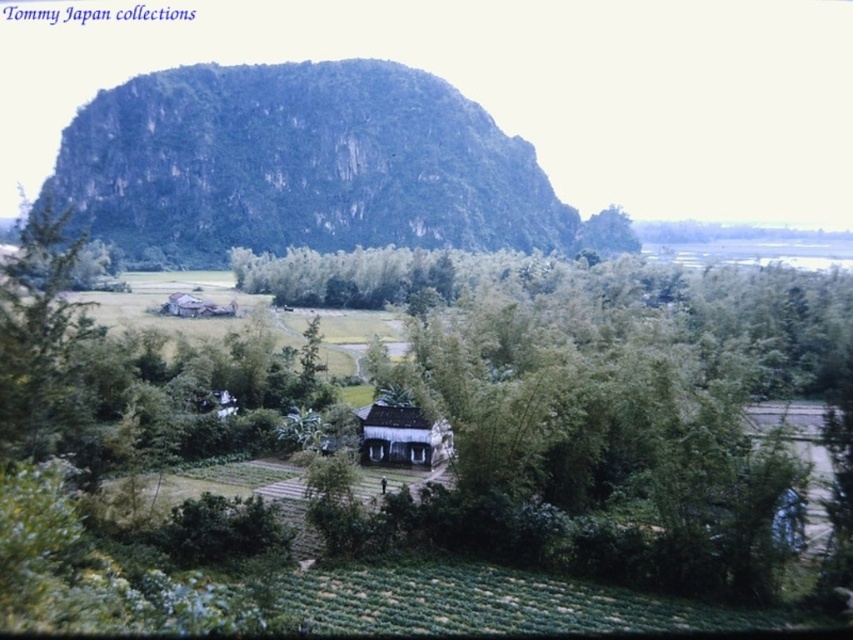
You are standing in the rural landscape and want to visit both the white wood hut at center and the wooden hut at center. Which one should you visit first to stay on the path that goes from left to right across the fields?

You should visit the wooden hut at center first because the white wood hut at center is to the right of it, so following the path from left to right, the wooden hut at center comes first.

You are standing at the center of the image. Which direction should you look to see the green leafy tree at left?

The green leafy tree at left is located at point (38, 326), which is to the left side of the image. Therefore, you should look to the left to see it.

You are standing in the rural landscape and want to take a photo of the wooden hut at center without the green leafy tree at left blocking the view. Which direction should you move to ensure the tree is out of frame?

The green leafy tree at left is located above the wooden hut at center, so you should move to the left side of the wooden hut at center to position yourself below the tree and avoid it blocking the view.